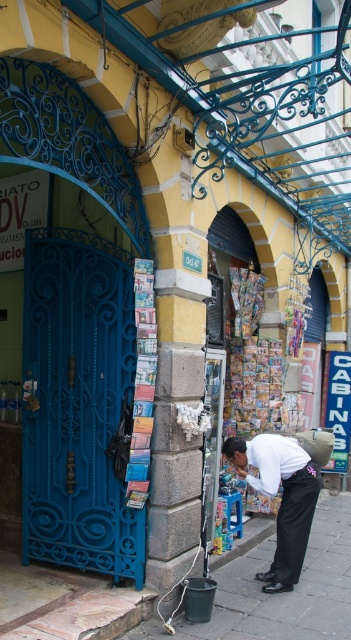
You are a delivery person trying to place a large package on the ground. You have two options in the scene described here. Which object, the smooth concrete pavement at lower center or the blue plastic stool at lower center, would provide a more stable and wider surface for placing the package?

The smooth concrete pavement at lower center has a larger width than the blue plastic stool at lower center, making it the more stable and wider surface for placing the package.

You are standing on the street looking at the historic building. Which object is closer to the ground, the smooth concrete pavement at lower center or the white cotton shirt at center?

The smooth concrete pavement at lower center is closer to the ground because it is located below the white cotton shirt at center.